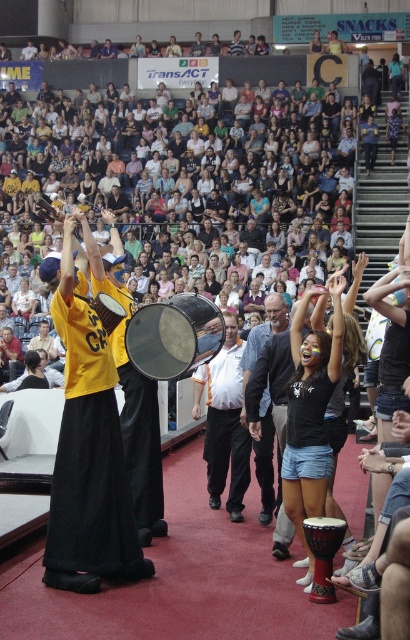
What do you see at coordinates (225, 420) in the screenshot?
I see `white cotton shirt at center` at bounding box center [225, 420].

Who is more distant from viewer, (234,518) or (175,294)?

Point (175,294)

Find the location of a particular element. Image resolution: width=410 pixels, height=640 pixels. white cotton shirt at center is located at coordinates (225, 420).

Does shiny metallic drum at center have a greater height compared to brown wooden drum at lower center?

Yes.

Is shiny metallic drum at center above brown wooden drum at lower center?

Correct, shiny metallic drum at center is located above brown wooden drum at lower center.

What do you see at coordinates (173, 337) in the screenshot? I see `shiny metallic drum at center` at bounding box center [173, 337].

At what (x,y) coordinates should I click in order to perform the action: click on shiny metallic drum at center. Please return your answer as a coordinate pair (x, y). Looking at the image, I should click on (173, 337).

Is white cotton shirt at center bigger than gray fabric jacket at center?

No.

Can you confirm if white cotton shirt at center is positioned above gray fabric jacket at center?

Actually, white cotton shirt at center is below gray fabric jacket at center.

Find the location of a particular element. The width and height of the screenshot is (410, 640). white cotton shirt at center is located at coordinates (225, 420).

Identify the location of white cotton shirt at center. (225, 420).